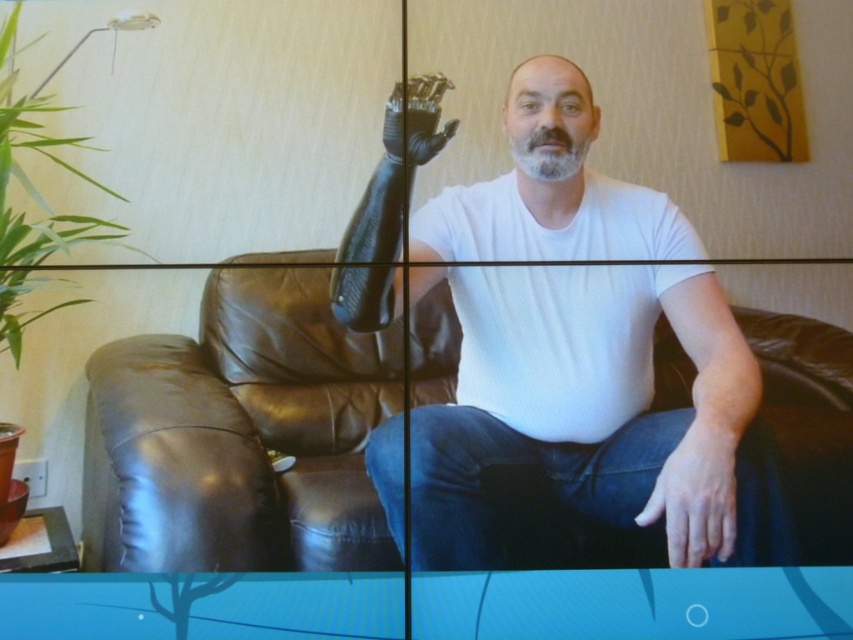
Describe the element at coordinates (698, 488) in the screenshot. I see `smooth skin hand at lower right` at that location.

Does smooth skin hand at lower right have a greater height compared to gray matte beard at center?

Correct, smooth skin hand at lower right is much taller as gray matte beard at center.

The image size is (853, 640). What are the coordinates of `smooth skin hand at lower right` in the screenshot? It's located at (698, 488).

The width and height of the screenshot is (853, 640). In order to click on smooth skin hand at lower right in this screenshot , I will do `click(698, 488)`.

Which is more to the right, smooth skin hand at lower right or black matte prosthetic hand at upper center?

smooth skin hand at lower right is more to the right.

Does smooth skin hand at lower right have a lesser width compared to black matte prosthetic hand at upper center?

No.

Locate an element on the screen. smooth skin hand at lower right is located at coordinates (698, 488).

Is point (440, 557) positioned before point (561, 148)?

Yes.

Between matte black arm at upper left and gray matte beard at center, which one appears on the right side from the viewer's perspective?

gray matte beard at center

At what (x,y) coordinates should I click in order to perform the action: click on matte black arm at upper left. Please return your answer as a coordinate pair (x, y). The image size is (853, 640). Looking at the image, I should click on (585, 410).

Locate an element on the screen. Image resolution: width=853 pixels, height=640 pixels. matte black arm at upper left is located at coordinates (585, 410).